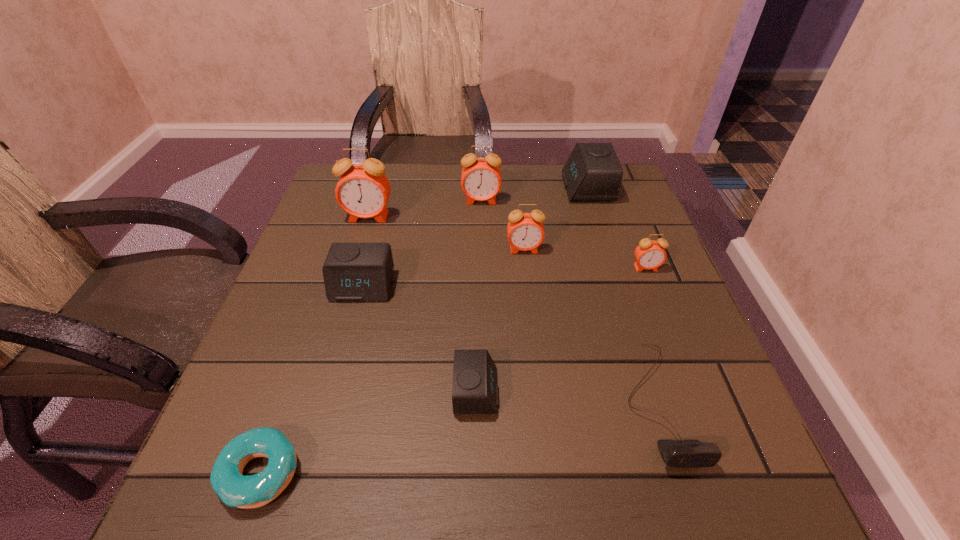
In the image, there is a desktop. At what (x,y) coordinates should I click in order to perform the action: click on vacant area at the near right corner. Please return your answer as a coordinate pair (x, y). This screenshot has height=540, width=960. Looking at the image, I should click on (752, 497).

The image size is (960, 540). I want to click on free space that is in between the farthest black alarm clock and the second farthest black alarm clock, so click(x=474, y=237).

Where is `vacant region between the webcam and the second smallest black alarm clock`? This screenshot has width=960, height=540. vacant region between the webcam and the second smallest black alarm clock is located at coordinates (510, 343).

Locate an element on the screen. unoccupied area between the shortest object and the nearest black alarm clock is located at coordinates (369, 432).

Image resolution: width=960 pixels, height=540 pixels. I want to click on unoccupied position between the nearest alarm clock and the webcam, so click(566, 396).

This screenshot has height=540, width=960. I want to click on free space between the webcam and the rightmost black alarm clock, so click(622, 295).

Locate an element on the screen. The image size is (960, 540). vacant region between the webcam and the shortest object is located at coordinates (459, 437).

You are a GUI agent. You are given a task and a screenshot of the screen. Output one action in this format:
    pyautogui.click(x=<x>, y=<y>)
    Task: Click on the vacant space in between the second black alarm clock from right to left and the shortest object
    
    Given the screenshot: What is the action you would take?
    pyautogui.click(x=369, y=432)

Identify the location of free point between the webcam and the second tallest object. This screenshot has width=960, height=540. (568, 301).

Identify the location of empty space between the webcam and the farthest black alarm clock. This screenshot has width=960, height=540. (622, 295).